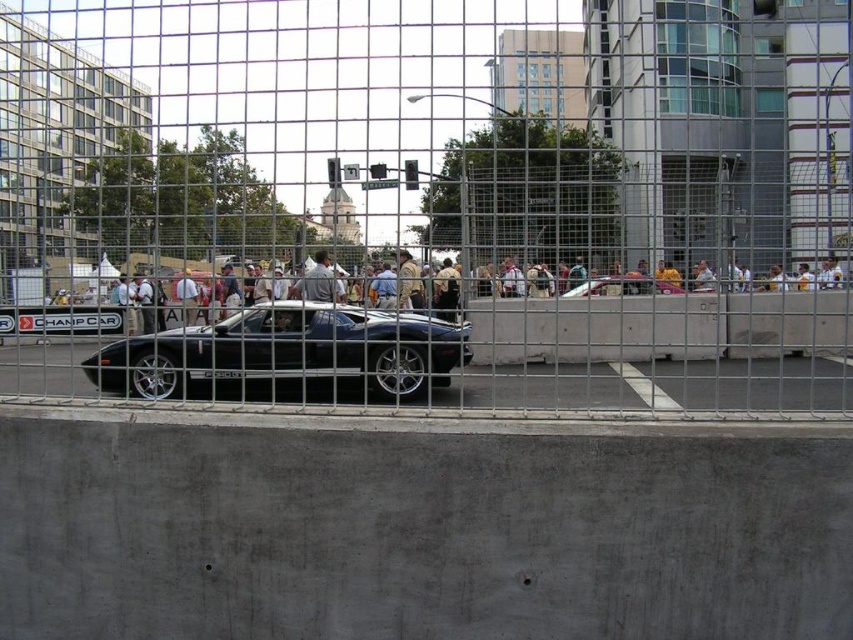
How distant is concrete at center from shiny silver sports car at center?

concrete at center is 9.62 feet from shiny silver sports car at center.

From the picture: Which of these two, concrete at center or shiny silver sports car at center, stands shorter?

concrete at center

Describe the element at coordinates (660, 326) in the screenshot. I see `concrete at center` at that location.

You are a GUI agent. You are given a task and a screenshot of the screen. Output one action in this format:
    pyautogui.click(x=<x>, y=<y>)
    Task: Click on the concrete at center
    
    Given the screenshot: What is the action you would take?
    pyautogui.click(x=660, y=326)

What do you see at coordinates (427, 200) in the screenshot?
I see `metal mesh fence at center` at bounding box center [427, 200].

Is point (750, 397) more distant than point (622, 291)?

That is False.

Where is `metal mesh fence at center`? The width and height of the screenshot is (853, 640). metal mesh fence at center is located at coordinates (427, 200).

You are a GUI agent. You are given a task and a screenshot of the screen. Output one action in this format:
    pyautogui.click(x=<x>, y=<y>)
    Task: Click on the metal mesh fence at center
    The height and width of the screenshot is (640, 853).
    Given the screenshot: What is the action you would take?
    pyautogui.click(x=427, y=200)

Is shiny silver sports car at center smaller than light gray fabric jacket at center?

Actually, shiny silver sports car at center might be larger than light gray fabric jacket at center.

Can you confirm if shiny silver sports car at center is shorter than light gray fabric jacket at center?

In fact, shiny silver sports car at center may be taller than light gray fabric jacket at center.

The height and width of the screenshot is (640, 853). What are the coordinates of `shiny silver sports car at center` in the screenshot? It's located at (621, 285).